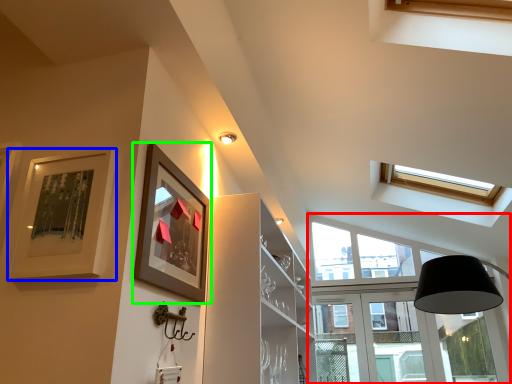
Question: Considering the real-world distances, which object is closest to window (highlighted by a red box)? picture frame (highlighted by a blue box) or picture frame (highlighted by a green box).

Choices:
 (A) picture frame
 (B) picture frame

Answer: (B)